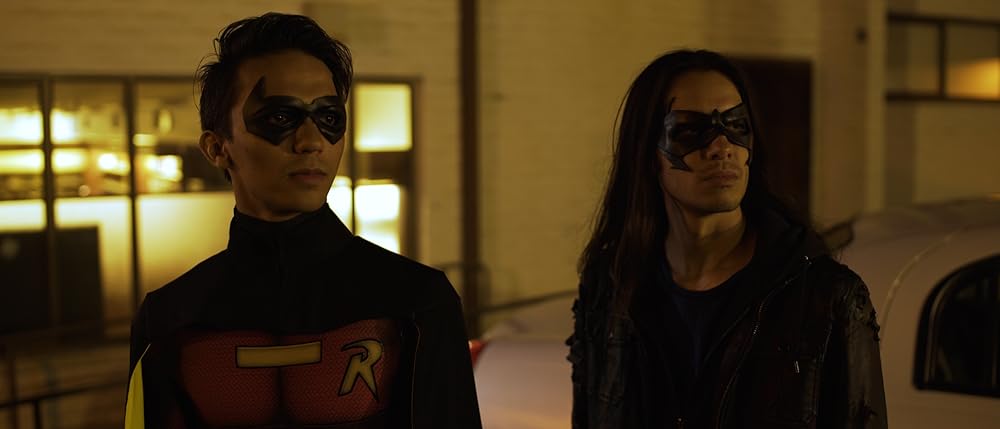
Where is `red chest`? The height and width of the screenshot is (429, 1000). red chest is located at coordinates (320, 392).